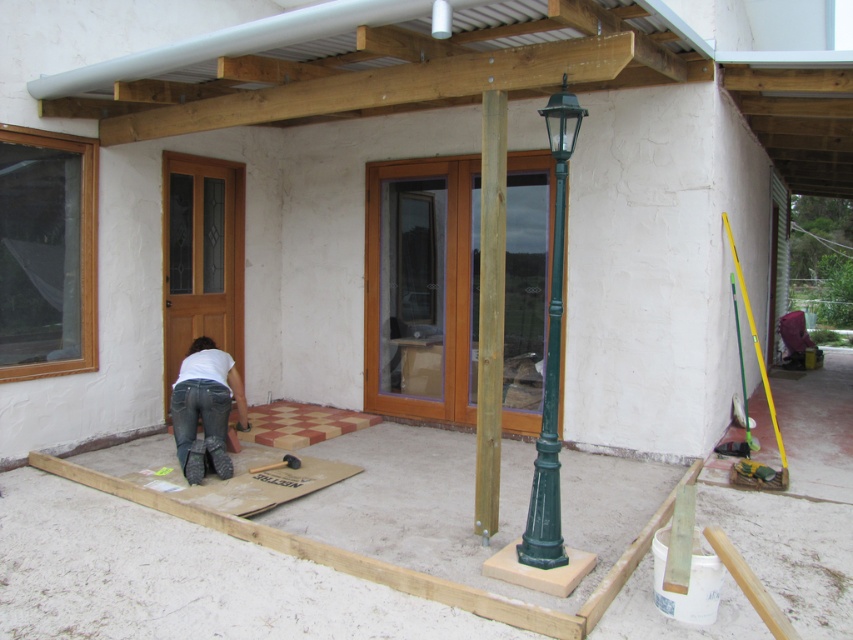
Question: Which point is closer to the camera taking this photo?

Choices:
 (A) (549, 108)
 (B) (183, 468)

Answer: (A)

Question: Which object is positioned farthest from the brown wooden pole at center?

Choices:
 (A) denim jeans at lower left
 (B) green painted metal pole at center

Answer: (A)

Question: Is green painted metal pole at center wider than denim jeans at lower left?

Choices:
 (A) yes
 (B) no

Answer: (B)

Question: Is brown wooden pole at center smaller than denim jeans at lower left?

Choices:
 (A) yes
 (B) no

Answer: (A)

Question: Is brown wooden pole at center closer to the viewer compared to green painted metal pole at center?

Choices:
 (A) yes
 (B) no

Answer: (B)

Question: Which of the following is the farthest from the observer?

Choices:
 (A) denim jeans at lower left
 (B) green painted metal pole at center

Answer: (A)